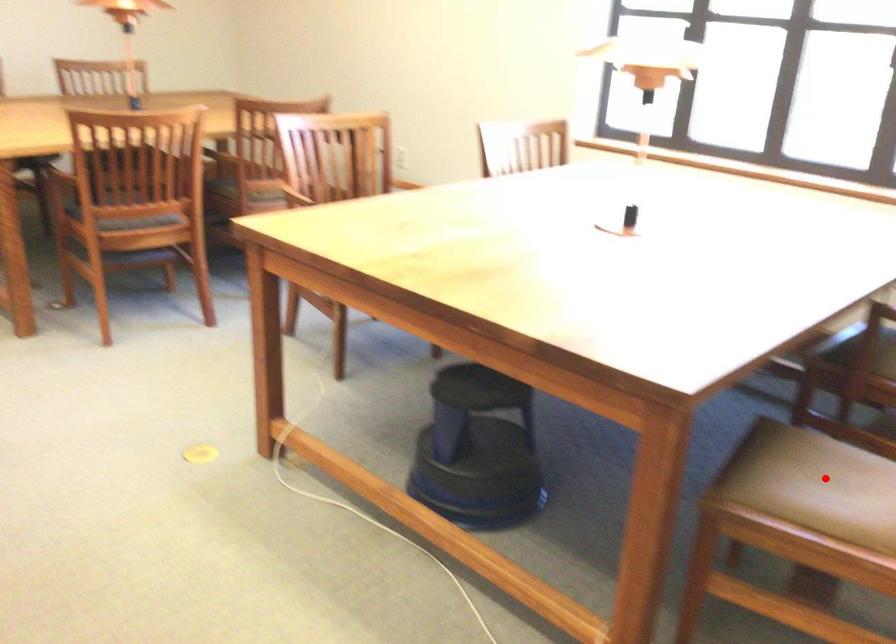
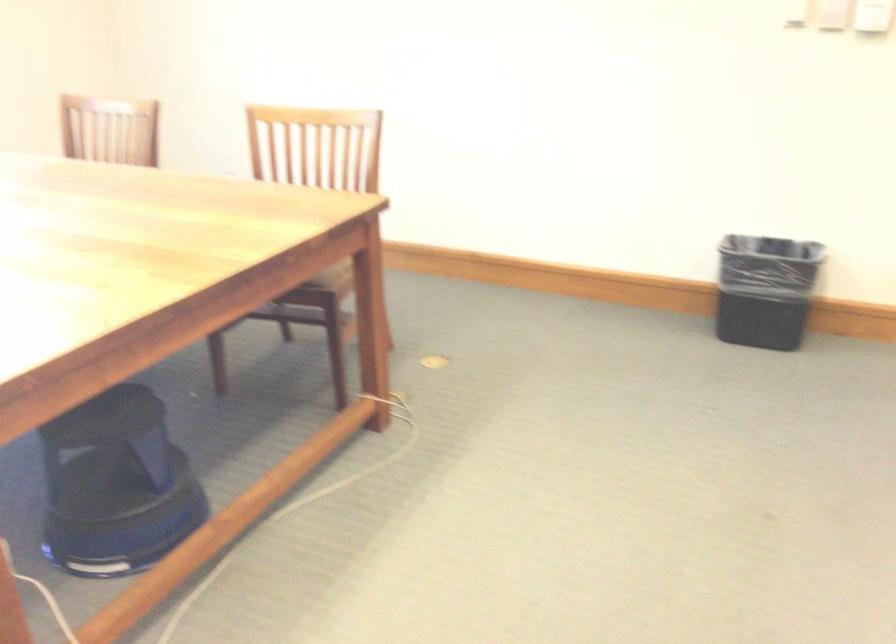
Question: I am providing you with two images of the same scene from different viewpoints. A red point is marked on the first image. At the location where the point appears in image 1, is it still visible in image 2?

Choices:
 (A) Yes
 (B) No

Answer: (B)